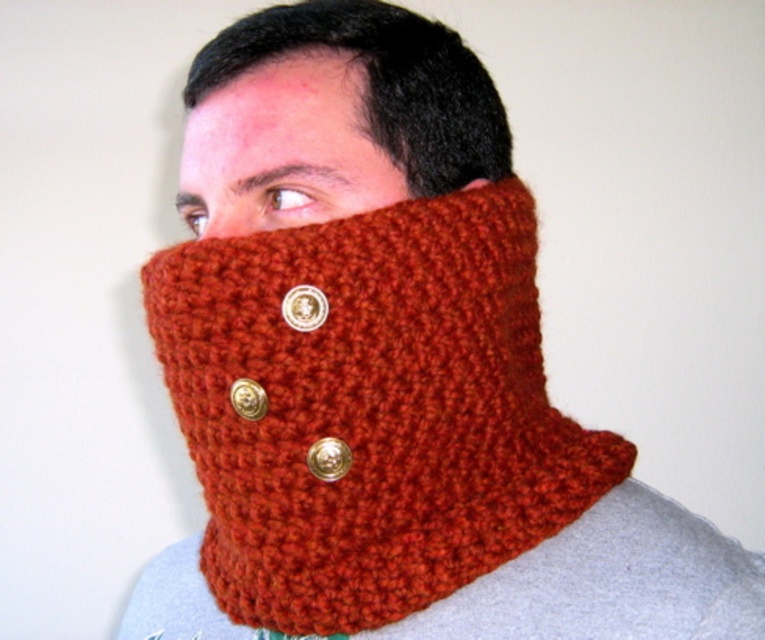
Question: Is rust knitted scarf at center to the left of orange knitted scarf at center from the viewer's perspective?

Choices:
 (A) yes
 (B) no

Answer: (B)

Question: Does orange knitted scarf at center come behind matte orange knit at center?

Choices:
 (A) no
 (B) yes

Answer: (A)

Question: Which of the following is the closest to the observer?

Choices:
 (A) orange knitted scarf at center
 (B) matte orange knit at center
 (C) rust knitted scarf at center

Answer: (C)

Question: Is rust knitted scarf at center to the right of matte orange knit at center from the viewer's perspective?

Choices:
 (A) no
 (B) yes

Answer: (B)

Question: Which object appears closest to the camera in this image?

Choices:
 (A) matte orange knit at center
 (B) orange knitted scarf at center
 (C) rust knitted scarf at center

Answer: (C)

Question: Which point is farther to the camera?

Choices:
 (A) rust knitted scarf at center
 (B) matte orange knit at center
 (C) orange knitted scarf at center

Answer: (B)